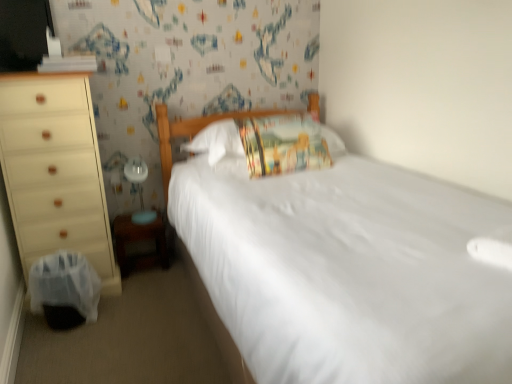
Measure the distance between point (139,189) and camera.

2.52 meters.

In order to click on white glossy table lamp at lower left in this screenshot , I will do `click(139, 189)`.

What do you see at coordinates (283, 144) in the screenshot? The width and height of the screenshot is (512, 384). I see `printed fabric pillow at center` at bounding box center [283, 144].

You are a GUI agent. You are given a task and a screenshot of the screen. Output one action in this format:
    pyautogui.click(x=<x>, y=<y>)
    Task: Click on the black plastic swivel chair at lower left
    The width and height of the screenshot is (512, 384).
    Given the screenshot: What is the action you would take?
    pyautogui.click(x=64, y=290)

This screenshot has width=512, height=384. I want to click on white glossy table lamp at lower left, so click(x=139, y=189).

In the scene shown: From the image's perspective, relative to black plastic swivel chair at lower left, is white smooth bed at center above or below?

Clearly, from the image's perspective, white smooth bed at center is above black plastic swivel chair at lower left.

Does white smooth bed at center come in front of black plastic swivel chair at lower left?

Yes, the depth of white smooth bed at center is less than that of black plastic swivel chair at lower left.

Is point (347, 159) closer or farther from the camera than point (93, 273)?

Point (347, 159) is positioned farther from the camera compared to point (93, 273).

At what (x,y) coordinates should I click in order to perform the action: click on table lamp that is above the white smooth bed at center (from a real-world perspective). Please return your answer as a coordinate pair (x, y). Looking at the image, I should click on (139, 189).

Is white glossy table lamp at lower left aimed at white smooth bed at center?

No.

Considering the sizes of objects white glossy table lamp at lower left and white smooth bed at center in the image provided, who is wider, white glossy table lamp at lower left or white smooth bed at center?

white smooth bed at center.

Measure the distance from white glossy table lamp at lower left to white smooth bed at center.

The distance of white glossy table lamp at lower left from white smooth bed at center is 1.11 meters.

Can you tell me how much wooden changing table at lower left and black plastic swivel chair at lower left differ in facing direction?

wooden changing table at lower left and black plastic swivel chair at lower left are facing 90 degrees away from each other.

Who is shorter, wooden changing table at lower left or black plastic swivel chair at lower left?

With less height is wooden changing table at lower left.

From a real-world perspective, relative to black plastic swivel chair at lower left, is wooden changing table at lower left vertically above or below?

wooden changing table at lower left is situated lower than black plastic swivel chair at lower left in the real world.

Considering the relative positions of wooden changing table at lower left and black plastic swivel chair at lower left in the image provided, is wooden changing table at lower left in front of black plastic swivel chair at lower left?

No, wooden changing table at lower left is further to the viewer.

From the picture: Does matte white dresser at left lie in front of white glossy table lamp at lower left?

Yes.

Which object is positioned more to the left, matte white dresser at left or white glossy table lamp at lower left?

matte white dresser at left is more to the left.

Is matte white dresser at left far from white glossy table lamp at lower left?

matte white dresser at left is actually quite close to white glossy table lamp at lower left.

From a real-world perspective, relative to white glossy table lamp at lower left, is matte white dresser at left vertically above or below?

From a real-world perspective, matte white dresser at left is physically above white glossy table lamp at lower left.

Locate an element on the screen. changing table on the left of white glossy table lamp at lower left is located at coordinates (138, 241).

Relative to white glossy table lamp at lower left, is wooden changing table at lower left in front or behind?

wooden changing table at lower left is behind white glossy table lamp at lower left.

Can you confirm if wooden changing table at lower left is smaller than white glossy table lamp at lower left?

Actually, wooden changing table at lower left might be larger than white glossy table lamp at lower left.

Considering the sizes of objects wooden changing table at lower left and white glossy table lamp at lower left in the image provided, who is wider, wooden changing table at lower left or white glossy table lamp at lower left?

wooden changing table at lower left.

Relative to white smooth bed at center, is printed fabric pillow at center in front or behind?

Clearly, printed fabric pillow at center is behind white smooth bed at center.

Which object is thinner, printed fabric pillow at center or white smooth bed at center?

Thinner between the two is printed fabric pillow at center.

Consider the image. From the image's perspective, which object appears higher, printed fabric pillow at center or white smooth bed at center?

printed fabric pillow at center.

From a real-world perspective, is white smooth bed at center on wooden changing table at lower left?

Yes, from a real-world perspective, white smooth bed at center is on top of wooden changing table at lower left.

How different are the orientations of white smooth bed at center and wooden changing table at lower left in degrees?

white smooth bed at center and wooden changing table at lower left are facing 1.08 degrees away from each other.

Visually, is white smooth bed at center positioned to the left or to the right of wooden changing table at lower left?

white smooth bed at center is positioned on wooden changing table at lower left's right side.

Where is `bed that is above the wooden changing table at lower left (from a real-world perspective)`? This screenshot has height=384, width=512. bed that is above the wooden changing table at lower left (from a real-world perspective) is located at coordinates (343, 268).

Identify the location of swivel chair on the left of white smooth bed at center. [x=64, y=290].

In order to click on table lamp behind the white smooth bed at center in this screenshot , I will do `click(139, 189)`.

Estimate the real-world distances between objects in this image. Which object is further from wooden changing table at lower left, matte white dresser at left or printed fabric pillow at center?

printed fabric pillow at center is further to wooden changing table at lower left.

Looking at this image, from the image, which object appears to be nearer to white smooth bed at center, white glossy table lamp at lower left or matte white dresser at left?

matte white dresser at left.

Consider the image. Based on their spatial positions, is black plastic swivel chair at lower left or white smooth bed at center further from matte white dresser at left?

The object further to matte white dresser at left is white smooth bed at center.

From the image, which object appears to be nearer to printed fabric pillow at center, wooden changing table at lower left or matte white dresser at left?

wooden changing table at lower left is closer to printed fabric pillow at center.

When comparing their distances from wooden changing table at lower left, does printed fabric pillow at center or white glossy table lamp at lower left seem closer?

white glossy table lamp at lower left is closer to wooden changing table at lower left.

Considering their positions, is white smooth bed at center positioned closer to matte white dresser at left than white glossy table lamp at lower left?

white glossy table lamp at lower left lies closer to matte white dresser at left than the other object.

Based on their spatial positions, is printed fabric pillow at center or matte white dresser at left closer to white smooth bed at center?

Among the two, printed fabric pillow at center is located nearer to white smooth bed at center.

Looking at the image, which one is located closer to black plastic swivel chair at lower left, wooden changing table at lower left or matte white dresser at left?

Among the two, matte white dresser at left is located nearer to black plastic swivel chair at lower left.

Locate an element on the screen. This screenshot has height=384, width=512. table lamp between black plastic swivel chair at lower left and wooden changing table at lower left from front to back is located at coordinates (139, 189).

Where is `swivel chair between white smooth bed at center and white glossy table lamp at lower left in the front-back direction`? swivel chair between white smooth bed at center and white glossy table lamp at lower left in the front-back direction is located at coordinates (64, 290).

I want to click on the chest of drawers located between white smooth bed at center and printed fabric pillow at center in the depth direction, so click(x=55, y=171).

This screenshot has height=384, width=512. I want to click on pillow positioned between white smooth bed at center and wooden changing table at lower left from near to far, so click(283, 144).